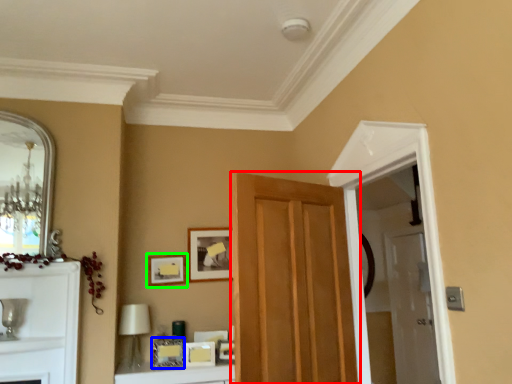
Question: Which object is positioned closest to door (highlighted by a red box)? Select from picture frame (highlighted by a blue box) and picture frame (highlighted by a green box).

Choices:
 (A) picture frame
 (B) picture frame

Answer: (A)